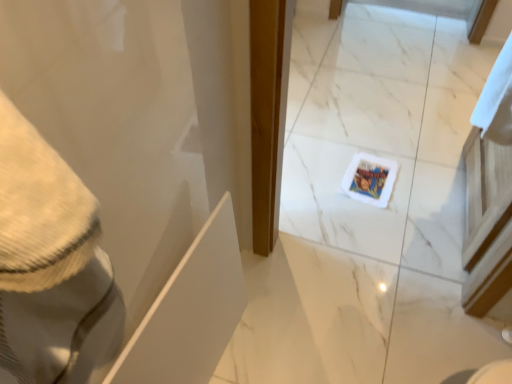
The width and height of the screenshot is (512, 384). Find the location of `free space underneath white plastic container at center (from a real-world perspective)`. free space underneath white plastic container at center (from a real-world perspective) is located at coordinates (372, 189).